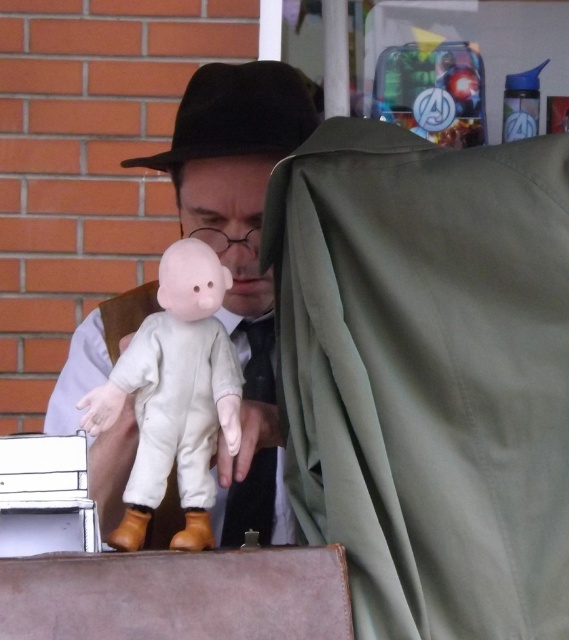
You are standing in the scene and want to place a small sticker on either the point at coordinate [145,468] or the point at coordinate [232,492]. Which point is closer to you?

The point at coordinate [145,468] is closer to you than the point at coordinate [232,492].

You are a delivery person who needs to place a 6 inch long package between the matte white doll at center and the black felt fedora at upper center. Can the package fit exactly between them without overlapping either object?

The matte white doll at center and the black felt fedora at upper center are 6.03 inches apart from each other. Since the package is 6 inches long, it can fit exactly between them with a small gap of 0.03 inches remaining.